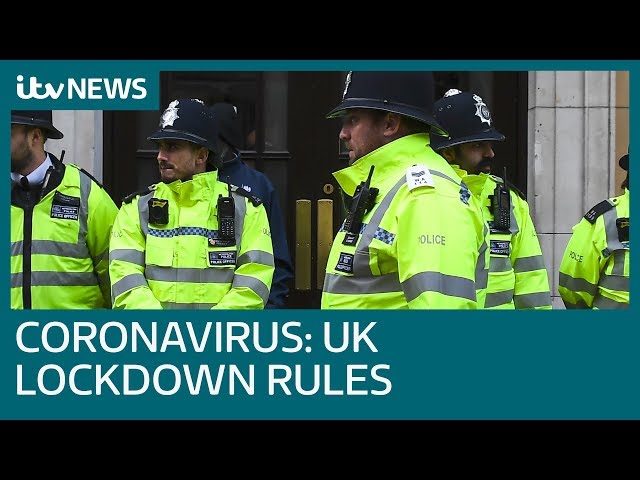
Where is `right gold handle plate`? The height and width of the screenshot is (480, 640). right gold handle plate is located at coordinates (326, 227).